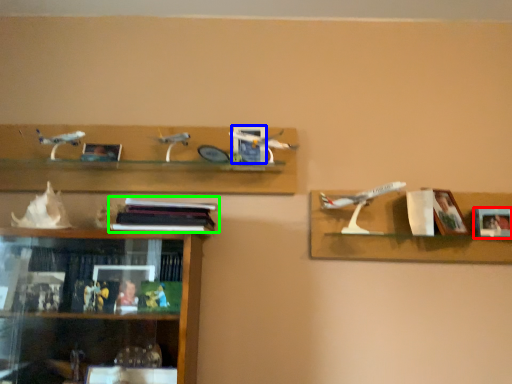
Question: Which object is the farthest from picture frame (highlighted by a red box)? Choose among these: picture frame (highlighted by a blue box) or book (highlighted by a green box).

Choices:
 (A) picture frame
 (B) book

Answer: (B)